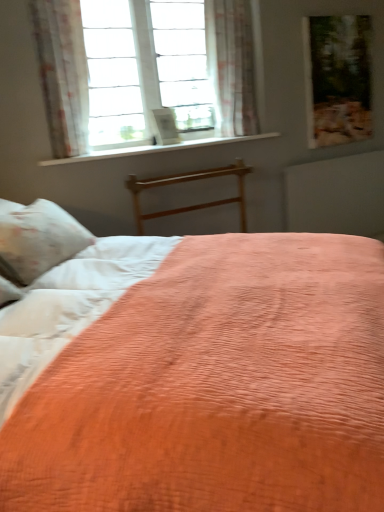
Where is `free space below wooden picture frame at upper right (from a real-world perspective)`? This screenshot has width=384, height=512. free space below wooden picture frame at upper right (from a real-world perspective) is located at coordinates (343, 155).